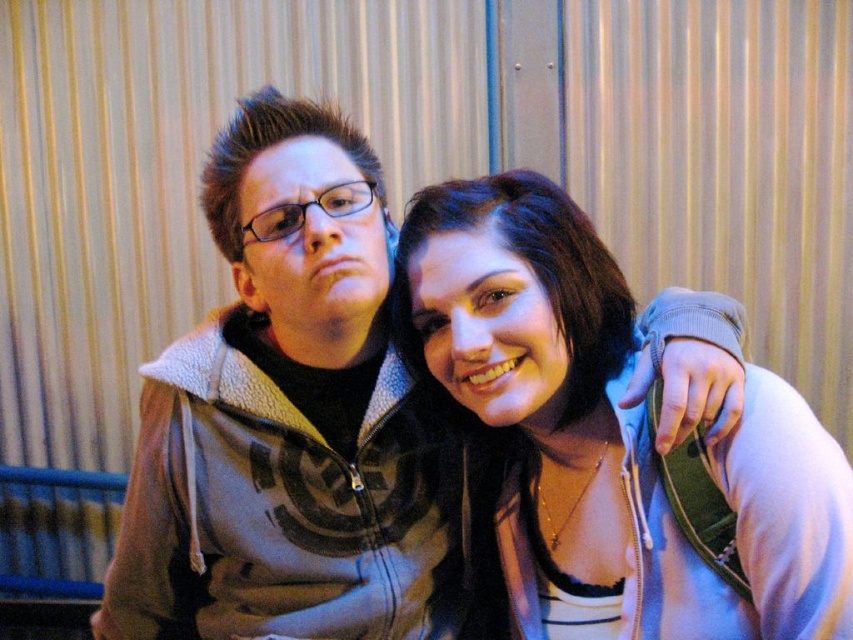
Please look at the image and identify which object the point at coordinates (x=288, y=419) is located on. The available options are the gray fleece hoodie at center and the light colored hoodie over striped shirt at right.

The point at coordinates (x=288, y=419) is located on the gray fleece hoodie at center.

You are standing in front of the image and want to locate the gray fleece hoodie at center. According to the coordinates provided, where would you find it?

The gray fleece hoodie at center is located at point coordinates of 0.656 on the x axis and 0.339 on the y axis.